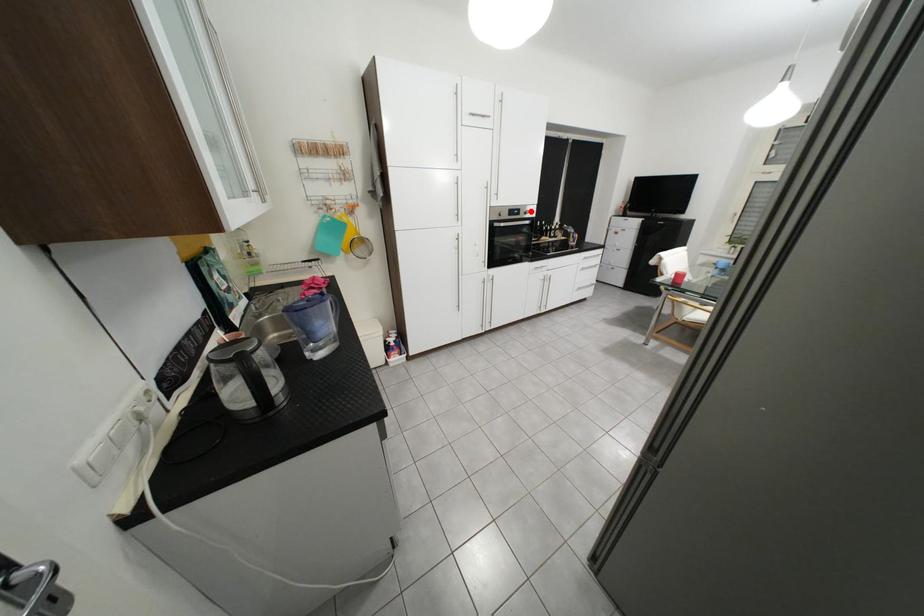
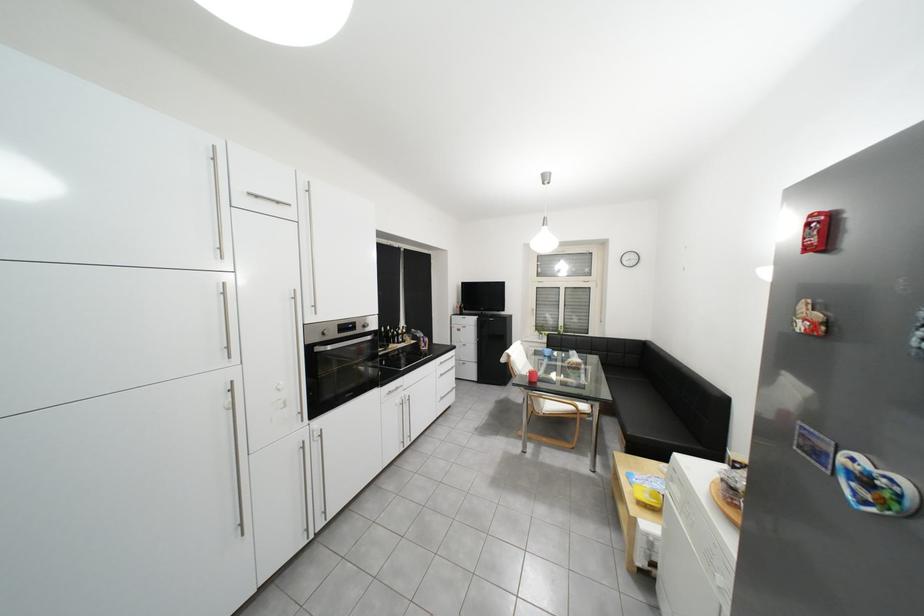
Question: I am providing you with two images of the same scene from different viewpoints. Given a red point in image1, look at the same physical point in image2. Is it:

Choices:
 (A) Closer to the viewpoint
 (B) Farther from the viewpoint

Answer: (B)